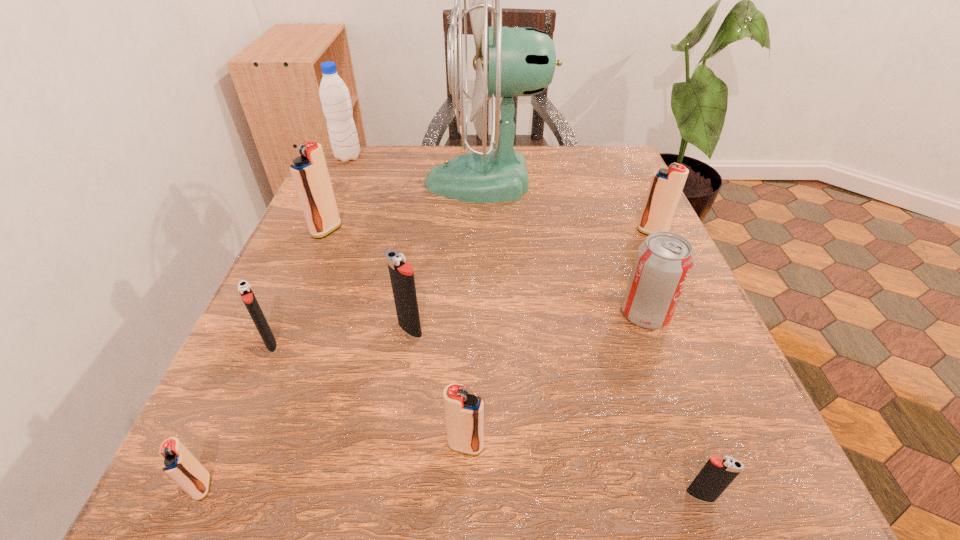
Locate an element on the screen. The width and height of the screenshot is (960, 540). vacant area that lies between the second igniter from right to left and the second nearest red igniter is located at coordinates (583, 470).

What are the coordinates of `unoccupied area between the nearest red igniter and the gray soda can` in the screenshot? It's located at (423, 400).

Select which object is the sixth closest to the fan. Please provide its 2D coordinates. Your answer should be formatted as a tuple, i.e. [(x, y)], where the tuple contains the x and y coordinates of a point satisfying the conditions above.

[(244, 289)]

Locate which object is the seventh closest to the smallest red igniter. Please provide its 2D coordinates. Your answer should be formatted as a tuple, i.e. [(x, y)], where the tuple contains the x and y coordinates of a point satisfying the conditions above.

[(663, 262)]

Identify which igniter is located as the fifth nearest to the tallest igniter. Please provide its 2D coordinates. Your answer should be formatted as a tuple, i.e. [(x, y)], where the tuple contains the x and y coordinates of a point satisfying the conditions above.

[(666, 186)]

Identify which igniter is the fourth closest to the second biggest black igniter. Please provide its 2D coordinates. Your answer should be formatted as a tuple, i.e. [(x, y)], where the tuple contains the x and y coordinates of a point satisfying the conditions above.

[(464, 413)]

Locate which red igniter is the fourth closest to the second smallest black igniter. Please provide its 2D coordinates. Your answer should be formatted as a tuple, i.e. [(x, y)], where the tuple contains the x and y coordinates of a point satisfying the conditions above.

[(666, 186)]

Choose which red igniter is the third nearest neighbor to the tallest igniter. Please provide its 2D coordinates. Your answer should be formatted as a tuple, i.e. [(x, y)], where the tuple contains the x and y coordinates of a point satisfying the conditions above.

[(666, 186)]

Where is `the closest black igniter to the fourth igniter from right to left`? the closest black igniter to the fourth igniter from right to left is located at coordinates (244, 289).

Identify which black igniter is located as the third nearest to the fifth farthest igniter. Please provide its 2D coordinates. Your answer should be formatted as a tuple, i.e. [(x, y)], where the tuple contains the x and y coordinates of a point satisfying the conditions above.

[(244, 289)]